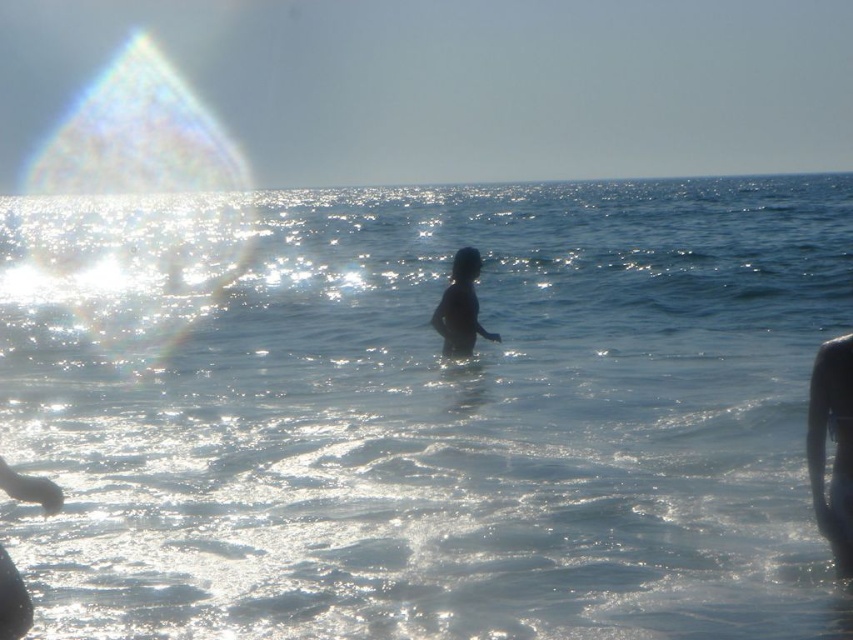
Can you confirm if clear water at center is positioned to the right of silhouette skin at center?

In fact, clear water at center is to the left of silhouette skin at center.

Can you confirm if clear water at center is positioned below silhouette skin at center?

Actually, clear water at center is above silhouette skin at center.

Is point (332, 580) positioned before point (454, 308)?

Yes, point (332, 580) is in front of point (454, 308).

The width and height of the screenshot is (853, 640). Find the location of `clear water at center`. clear water at center is located at coordinates (426, 413).

Can you confirm if clear water at center is smaller than transparent wet skin at center?

Actually, clear water at center might be larger than transparent wet skin at center.

Which of these two, clear water at center or transparent wet skin at center, stands shorter?

With less height is transparent wet skin at center.

Which is in front, point (86, 273) or point (827, 516)?

Point (827, 516) is in front.

Where is `clear water at center`? This screenshot has height=640, width=853. clear water at center is located at coordinates (426, 413).

Is point (834, 413) closer to camera compared to point (468, 342)?

Yes, it is in front of point (468, 342).

Does transparent wet skin at center have a smaller size compared to silhouette skin at center?

Correct, transparent wet skin at center occupies less space than silhouette skin at center.

Which is in front, point (817, 481) or point (465, 349)?

Point (817, 481) is more forward.

Where is `transparent wet skin at center`? The width and height of the screenshot is (853, 640). transparent wet skin at center is located at coordinates (834, 445).